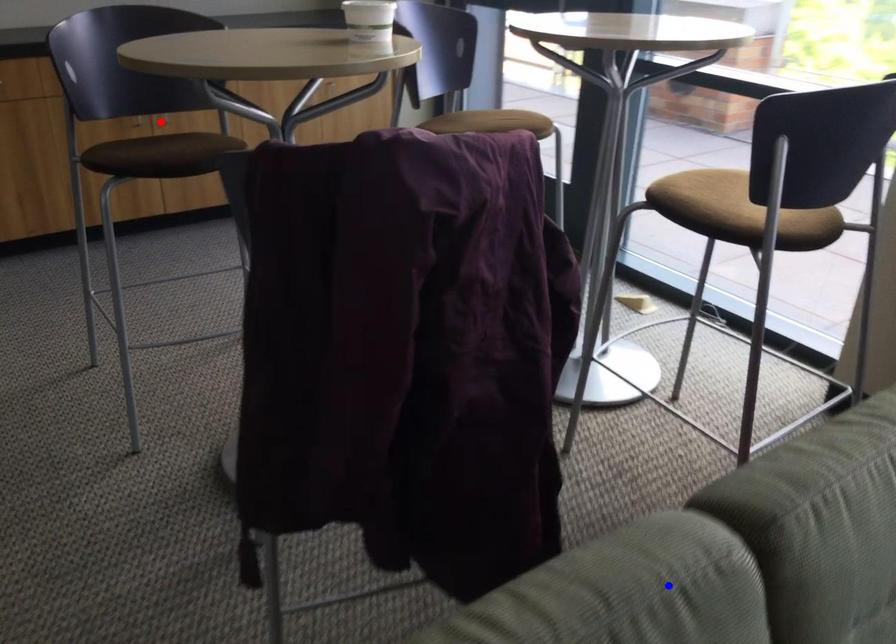
Question: Which of the two points in the image is closer to the camera?

Choices:
 (A) Blue point is closer.
 (B) Red point is closer.

Answer: (A)